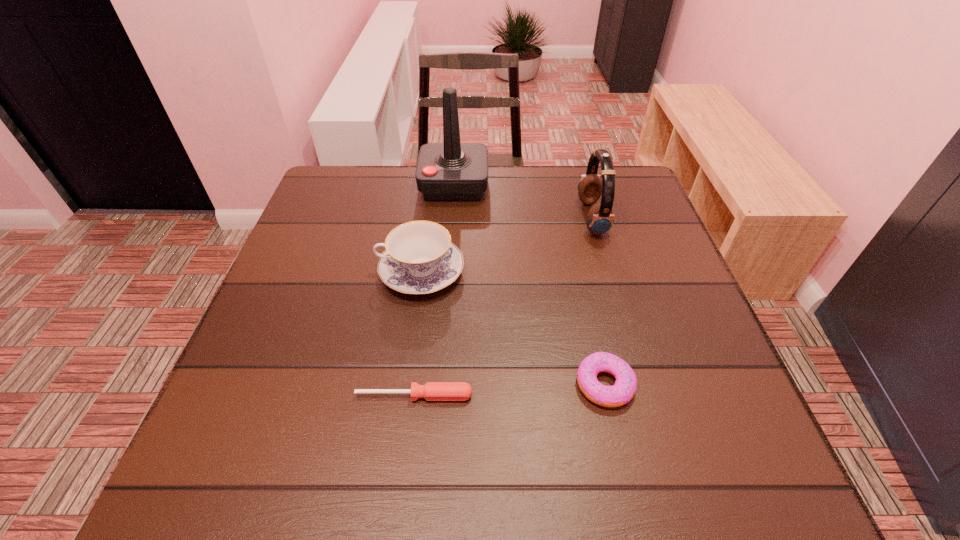
Where is `joystick`? This screenshot has width=960, height=540. joystick is located at coordinates (450, 171).

The image size is (960, 540). In order to click on headset in this screenshot , I will do `click(599, 220)`.

I want to click on the third tallest object, so click(420, 258).

Identify the location of chinaware. This screenshot has height=540, width=960. (420, 258).

Image resolution: width=960 pixels, height=540 pixels. Identify the location of the fourth tallest object. (625, 386).

Find the location of a particular element. the shortest object is located at coordinates (432, 391).

Image resolution: width=960 pixels, height=540 pixels. What are the coordinates of `vacant point located on the left of the joystick` in the screenshot? It's located at (336, 185).

The height and width of the screenshot is (540, 960). In order to click on vacant space located on the ear cup of the headset in this screenshot , I will do `click(457, 219)`.

You are a GUI agent. You are given a task and a screenshot of the screen. Output one action in this format:
    pyautogui.click(x=<x>, y=<y>)
    Task: Click on the vacant space located 0.260m on the ear cup of the headset
    The height and width of the screenshot is (540, 960).
    Given the screenshot: What is the action you would take?
    pyautogui.click(x=480, y=219)

Find the location of a particular element. free region located on the ear cup of the headset is located at coordinates (453, 219).